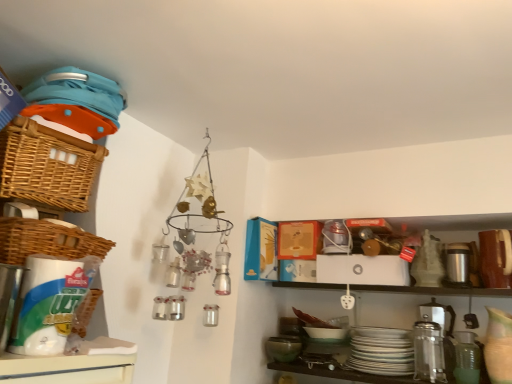
Question: Is woven brown basket at left, the second basket positioned from the top, smaller than woven brown basket at upper left, the 1th basket when ordered from top to bottom?

Choices:
 (A) no
 (B) yes

Answer: (B)

Question: Does woven brown basket at left, the second basket positioned from the top, lie in front of woven brown basket at upper left, the 1th basket when ordered from top to bottom?

Choices:
 (A) yes
 (B) no

Answer: (A)

Question: Is there a large distance between woven brown basket at left, arranged as the 1th basket when ordered from the bottom, and woven brown basket at upper left, marked as the second basket in a bottom-to-top arrangement?

Choices:
 (A) no
 (B) yes

Answer: (A)

Question: Considering the relative sizes of woven brown basket at left, arranged as the 1th basket when ordered from the bottom, and woven brown basket at upper left, marked as the second basket in a bottom-to-top arrangement, in the image provided, is woven brown basket at left, arranged as the 1th basket when ordered from the bottom, taller than woven brown basket at upper left, marked as the second basket in a bottom-to-top arrangement,?

Choices:
 (A) yes
 (B) no

Answer: (B)

Question: From a real-world perspective, is woven brown basket at left, arranged as the 1th basket when ordered from the bottom, under woven brown basket at upper left, marked as the second basket in a bottom-to-top arrangement?

Choices:
 (A) yes
 (B) no

Answer: (A)

Question: Do you think silver metallic thermos at right is within green matte mixing bowl at lower center, or outside of it?

Choices:
 (A) outside
 (B) inside

Answer: (A)

Question: From the image's perspective, is silver metallic thermos at right located above or below green matte mixing bowl at lower center?

Choices:
 (A) below
 (B) above

Answer: (B)

Question: In terms of width, does silver metallic thermos at right look wider or thinner when compared to green matte mixing bowl at lower center?

Choices:
 (A) thin
 (B) wide

Answer: (B)

Question: From a real-world perspective, is silver metallic thermos at right positioned above or below green matte mixing bowl at lower center?

Choices:
 (A) below
 (B) above

Answer: (B)

Question: Considering their positions, is woven brown basket at left, the second basket positioned from the top, located in front of or behind woven brown basket at upper left, the 1th basket when ordered from top to bottom?

Choices:
 (A) front
 (B) behind

Answer: (A)

Question: Is woven brown basket at left, the second basket positioned from the top, inside or outside of woven brown basket at upper left, the 1th basket when ordered from top to bottom?

Choices:
 (A) inside
 (B) outside

Answer: (B)

Question: From the image's perspective, is woven brown basket at left, the second basket positioned from the top, located above or below woven brown basket at upper left, marked as the second basket in a bottom-to-top arrangement?

Choices:
 (A) above
 (B) below

Answer: (B)

Question: Considering the positions of woven brown basket at left, arranged as the 1th basket when ordered from the bottom, and woven brown basket at upper left, marked as the second basket in a bottom-to-top arrangement, in the image, is woven brown basket at left, arranged as the 1th basket when ordered from the bottom, wider or thinner than woven brown basket at upper left, marked as the second basket in a bottom-to-top arrangement,?

Choices:
 (A) wide
 (B) thin

Answer: (B)

Question: From the image's perspective, is woven brown basket at upper left, the 1th basket when ordered from top to bottom, located above or below green matte mixing bowl at lower center?

Choices:
 (A) above
 (B) below

Answer: (A)

Question: From a real-world perspective, is woven brown basket at upper left, marked as the second basket in a bottom-to-top arrangement, positioned above or below green matte mixing bowl at lower center?

Choices:
 (A) above
 (B) below

Answer: (A)